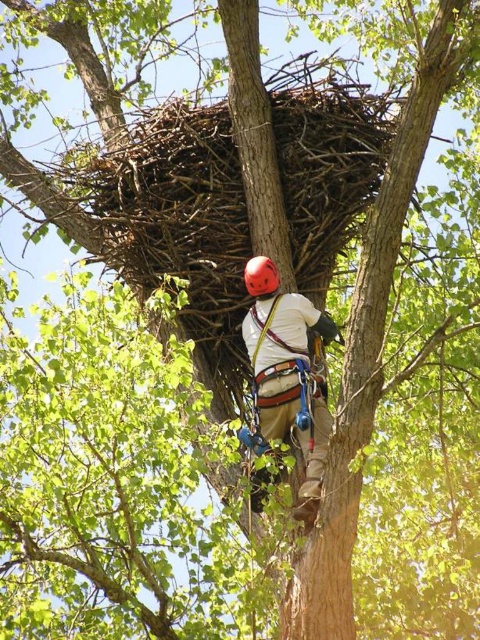
You are a safety inspector reviewing the tree work scene. You notice a point marked at coordinates (x=287, y=332). What object is located at that point?

The point at coordinates (x=287, y=332) marks the white fabric safety vest at center.

You are a safety inspector assessing the equipment of the worker in the image. The worker is wearing a matte white helmet at center and a white fabric safety vest at center. Which piece of equipment is taller?

The matte white helmet at center is much taller than the white fabric safety vest at center.

You are a safety inspector assessing the tree worker. You notice the white fabric safety vest at center and the matte red helmet at center. Which piece of equipment is positioned higher on the worker?

The white fabric safety vest at center is taller than matte red helmet at center, so the safety vest is positioned higher on the worker than the helmet.